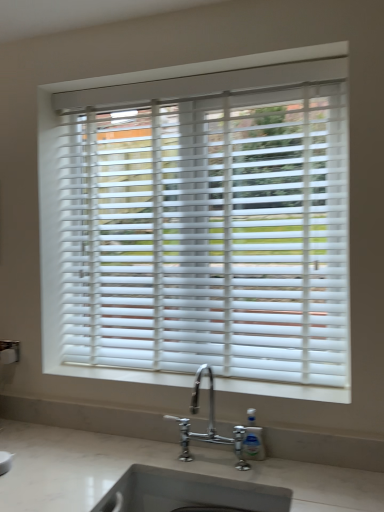
Question: Is clear plastic soap dispenser at lower center positioned behind white matte window sill at center?

Choices:
 (A) yes
 (B) no

Answer: (B)

Question: From the image's perspective, is clear plastic soap dispenser at lower center under white matte window sill at center?

Choices:
 (A) no
 (B) yes

Answer: (B)

Question: Is clear plastic soap dispenser at lower center touching white matte window sill at center?

Choices:
 (A) no
 (B) yes

Answer: (A)

Question: Considering the relative positions of clear plastic soap dispenser at lower center and white matte window sill at center in the image provided, is clear plastic soap dispenser at lower center to the left of white matte window sill at center from the viewer's perspective?

Choices:
 (A) no
 (B) yes

Answer: (A)

Question: Does clear plastic soap dispenser at lower center have a greater width compared to white matte window sill at center?

Choices:
 (A) no
 (B) yes

Answer: (A)

Question: Can you confirm if clear plastic soap dispenser at lower center is shorter than white matte window sill at center?

Choices:
 (A) yes
 (B) no

Answer: (B)

Question: Considering the relative positions of clear plastic soap dispenser at lower center and chrome metallic faucet at lower center in the image provided, is clear plastic soap dispenser at lower center to the left of chrome metallic faucet at lower center from the viewer's perspective?

Choices:
 (A) yes
 (B) no

Answer: (B)

Question: Does clear plastic soap dispenser at lower center have a larger size compared to chrome metallic faucet at lower center?

Choices:
 (A) no
 (B) yes

Answer: (A)

Question: Can you confirm if clear plastic soap dispenser at lower center is thinner than chrome metallic faucet at lower center?

Choices:
 (A) no
 (B) yes

Answer: (B)

Question: From the image's perspective, is clear plastic soap dispenser at lower center on top of chrome metallic faucet at lower center?

Choices:
 (A) no
 (B) yes

Answer: (A)

Question: Is chrome metallic faucet at lower center at the back of clear plastic soap dispenser at lower center?

Choices:
 (A) yes
 (B) no

Answer: (B)

Question: Is there a large distance between clear plastic soap dispenser at lower center and chrome metallic faucet at lower center?

Choices:
 (A) no
 (B) yes

Answer: (A)

Question: Is white matte window sill at center placed right next to clear plastic soap dispenser at lower center?

Choices:
 (A) no
 (B) yes

Answer: (A)